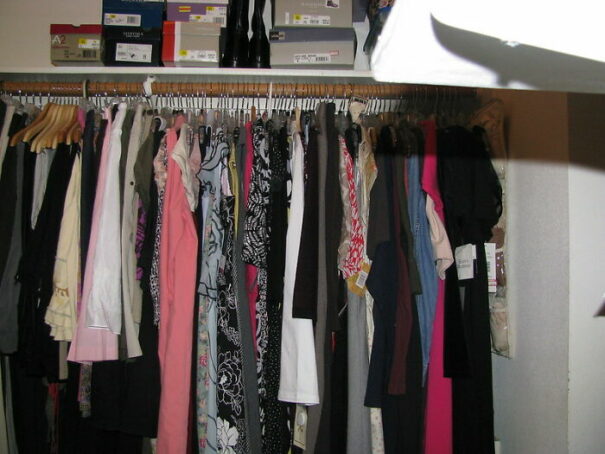
Where is `white hanger`? This screenshot has height=454, width=605. white hanger is located at coordinates (267, 110).